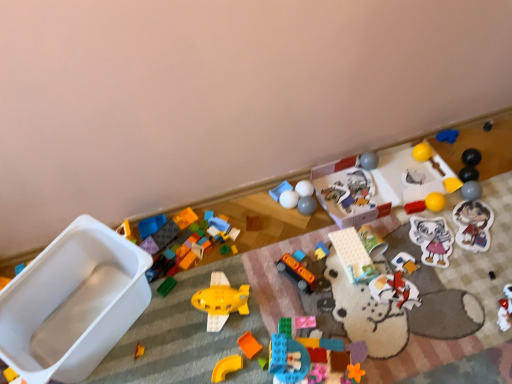
Find the location of `vacant space in between orange matte bus at center, the sixteenth toy in the right-to-left sequence, and translucent plastic blocks at center, positioned as the 15th toy in right-to-left order`. vacant space in between orange matte bus at center, the sixteenth toy in the right-to-left sequence, and translucent plastic blocks at center, positioned as the 15th toy in right-to-left order is located at coordinates (304, 310).